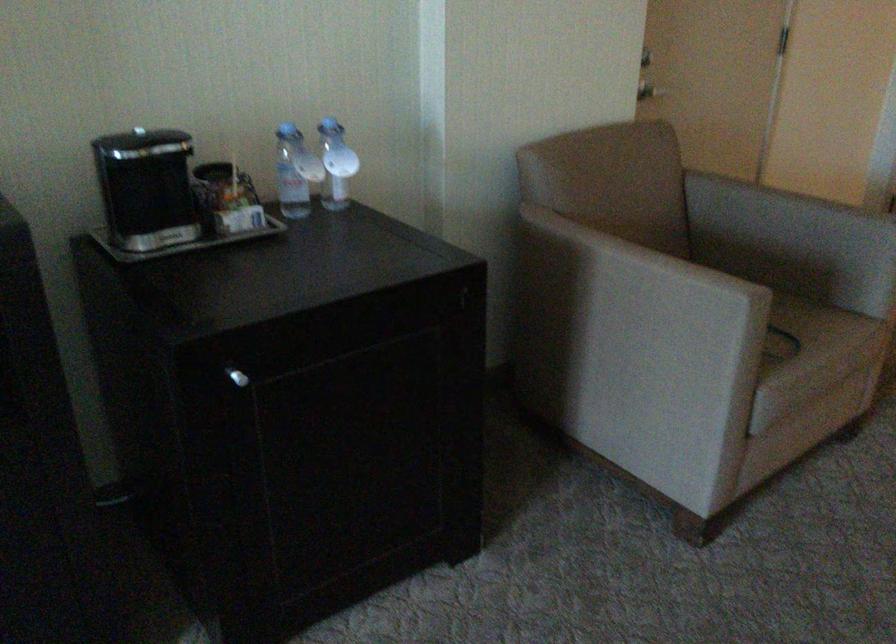
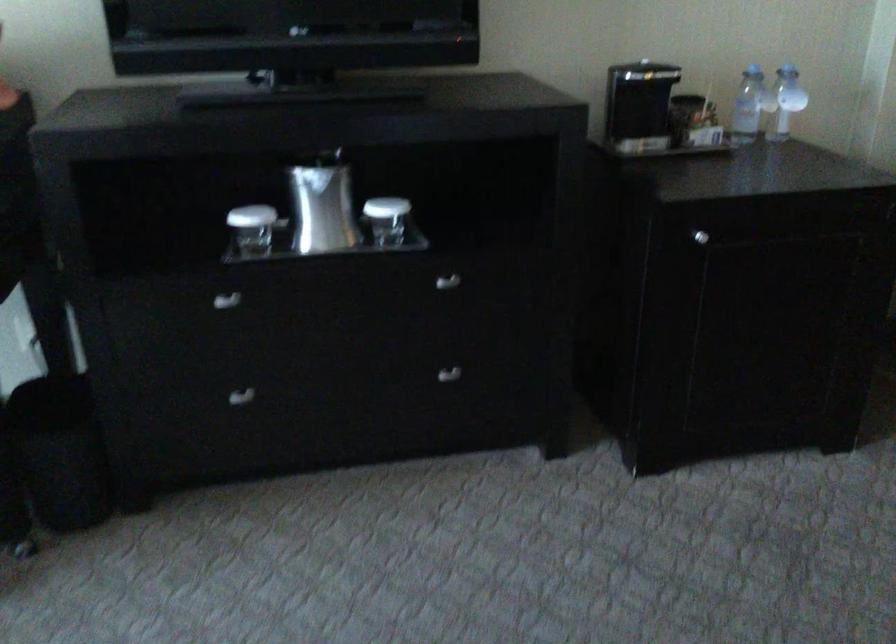
Question: The camera is either moving clockwise (left) or counter-clockwise (right) around the object. The first image is from the beginning of the video and the second image is from the end. Is the camera moving left or right when shooting the video?

Choices:
 (A) Left
 (B) Right

Answer: (B)